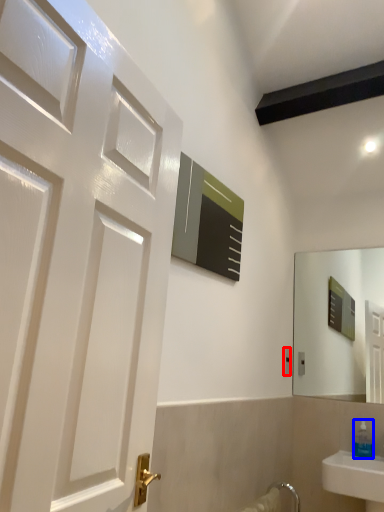
Question: Which point is further to the camera, electric outlet (highlighted by a red box) or soap dispenser (highlighted by a blue box)?

Choices:
 (A) electric outlet
 (B) soap dispenser

Answer: (A)